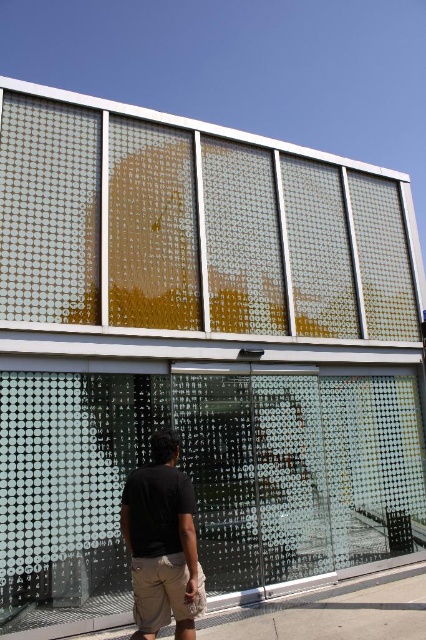
Question: Which point appears closest to the camera in this image?

Choices:
 (A) (233, 308)
 (B) (192, 520)

Answer: (B)

Question: Among these points, which one is farthest from the camera?

Choices:
 (A) (120, 637)
 (B) (385, 211)
 (C) (190, 561)

Answer: (B)

Question: Is black matte shirt at center thinner than gray concrete pavement at lower center?

Choices:
 (A) no
 (B) yes

Answer: (B)

Question: Is black matte shirt at center bigger than gray concrete pavement at lower center?

Choices:
 (A) yes
 (B) no

Answer: (B)

Question: Is black matte shirt at center further to camera compared to gray concrete pavement at lower center?

Choices:
 (A) yes
 (B) no

Answer: (B)

Question: Among these objects, which one is farthest from the camera?

Choices:
 (A) black matte shirt at center
 (B) gray concrete pavement at lower center
 (C) transparent glass window at upper center

Answer: (B)